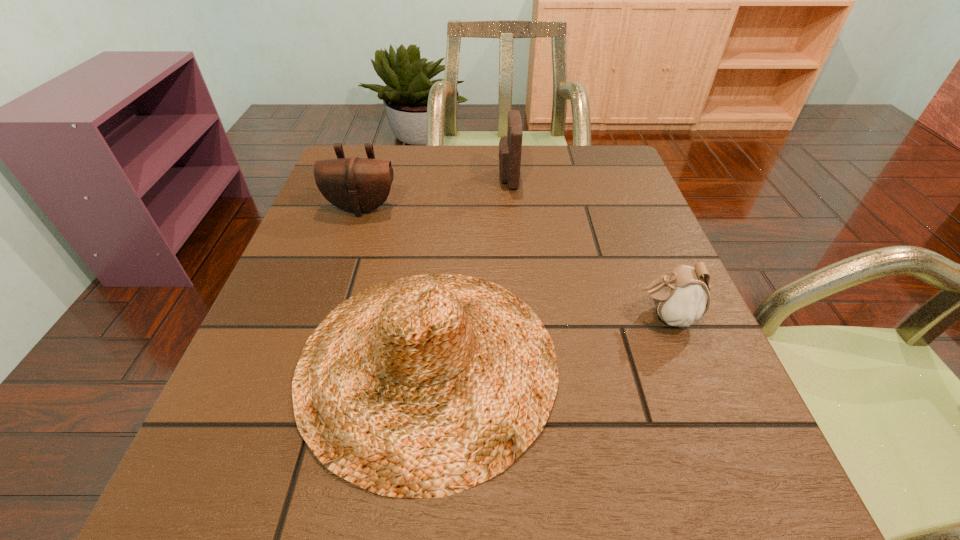
Where is `the second pouch from left to right`? the second pouch from left to right is located at coordinates (510, 146).

This screenshot has height=540, width=960. Identify the location of the farthest pouch. (510, 146).

Find the location of a particular element. Image resolution: width=960 pixels, height=540 pixels. the second farthest object is located at coordinates tap(358, 185).

This screenshot has width=960, height=540. Find the location of `the second farthest pouch`. the second farthest pouch is located at coordinates (358, 185).

Where is `sunhat`? The width and height of the screenshot is (960, 540). sunhat is located at coordinates (421, 387).

The height and width of the screenshot is (540, 960). I want to click on the rightmost pouch, so click(681, 297).

This screenshot has height=540, width=960. What are the coordinates of `the shortest object` in the screenshot? It's located at (681, 297).

Identify the location of vacant space located with an open flap on the farthest object. This screenshot has height=540, width=960. (478, 178).

This screenshot has height=540, width=960. What are the coordinates of `free space located with an open flap on the farthest object` in the screenshot? It's located at (408, 178).

The image size is (960, 540). I want to click on free spot located 0.210m with an open flap on the farthest object, so click(416, 178).